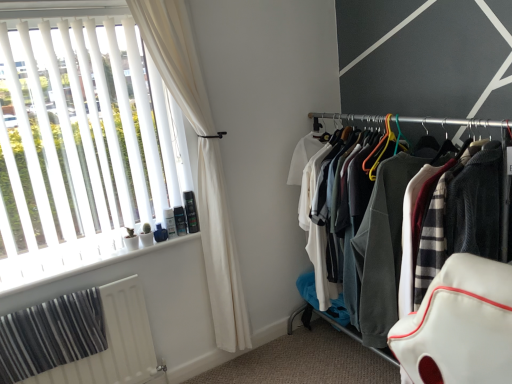
Question: Does white fabric curtain at left lie behind textured fabric clothes at right?

Choices:
 (A) yes
 (B) no

Answer: (A)

Question: Is white fabric curtain at left to the left of textured fabric clothes at right from the viewer's perspective?

Choices:
 (A) no
 (B) yes

Answer: (B)

Question: Is white fabric curtain at left aimed at textured fabric clothes at right?

Choices:
 (A) yes
 (B) no

Answer: (B)

Question: Considering the relative sizes of white fabric curtain at left and textured fabric clothes at right in the image provided, is white fabric curtain at left bigger than textured fabric clothes at right?

Choices:
 (A) yes
 (B) no

Answer: (B)

Question: Considering the relative sizes of white fabric curtain at left and textured fabric clothes at right in the image provided, is white fabric curtain at left thinner than textured fabric clothes at right?

Choices:
 (A) yes
 (B) no

Answer: (A)

Question: From the image's perspective, is white blinds at left located above or below white fabric curtain at left?

Choices:
 (A) above
 (B) below

Answer: (A)

Question: In terms of width, does white blinds at left look wider or thinner when compared to white fabric curtain at left?

Choices:
 (A) thin
 (B) wide

Answer: (A)

Question: Considering the positions of white blinds at left and white fabric curtain at left in the image, is white blinds at left taller or shorter than white fabric curtain at left?

Choices:
 (A) tall
 (B) short

Answer: (B)

Question: From a real-world perspective, relative to white fabric curtain at left, is white blinds at left vertically above or below?

Choices:
 (A) above
 (B) below

Answer: (A)

Question: From the image's perspective, is white plastic window sill at lower left located above or below white fabric curtain at left?

Choices:
 (A) above
 (B) below

Answer: (B)

Question: Is white plastic window sill at lower left inside or outside of white fabric curtain at left?

Choices:
 (A) outside
 (B) inside

Answer: (A)

Question: Looking at their shapes, would you say white plastic window sill at lower left is wider or thinner than white fabric curtain at left?

Choices:
 (A) wide
 (B) thin

Answer: (A)

Question: Is white plastic window sill at lower left in front of or behind white fabric curtain at left in the image?

Choices:
 (A) behind
 (B) front

Answer: (A)

Question: Based on their sizes in the image, would you say white blinds at left is bigger or smaller than white plastic window sill at lower left?

Choices:
 (A) big
 (B) small

Answer: (A)

Question: Is white blinds at left situated inside white plastic window sill at lower left or outside?

Choices:
 (A) outside
 (B) inside

Answer: (A)